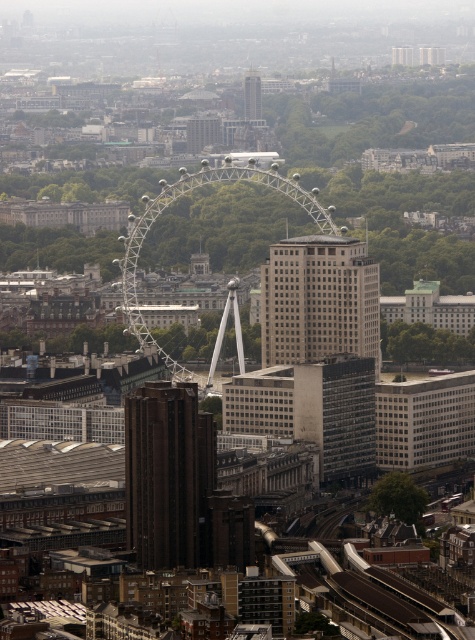
Question: Is gray concrete skyscraper at center smaller than shiny metallic ferris wheel at center?

Choices:
 (A) no
 (B) yes

Answer: (B)

Question: Among these points, which one is farthest from the camera?

Choices:
 (A) click(x=380, y=353)
 (B) click(x=155, y=541)

Answer: (B)

Question: Among these objects, which one is farthest from the camera?

Choices:
 (A) brown textured building at center
 (B) shiny metallic ferris wheel at center
 (C) matte glass tower at center

Answer: (C)

Question: Among these objects, which one is farthest from the camera?

Choices:
 (A) shiny metallic ferris wheel at center
 (B) brown textured building at center
 (C) matte glass tower at center

Answer: (C)

Question: Can you confirm if brown textured building at center is thinner than gray concrete skyscraper at center?

Choices:
 (A) no
 (B) yes

Answer: (B)

Question: Does gray concrete skyscraper at center appear under matte glass tower at center?

Choices:
 (A) yes
 (B) no

Answer: (A)